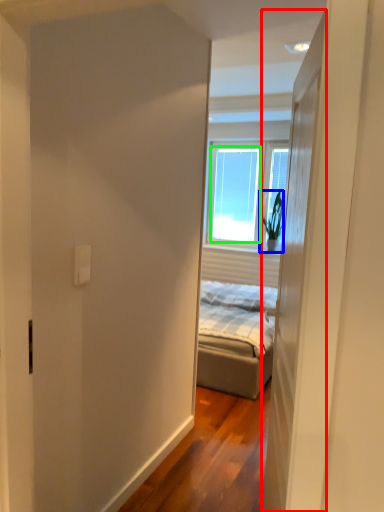
Question: Which object is the closest to the door (highlighted by a red box)? Choose among these: houseplant (highlighted by a blue box) or window (highlighted by a green box).

Choices:
 (A) houseplant
 (B) window

Answer: (A)